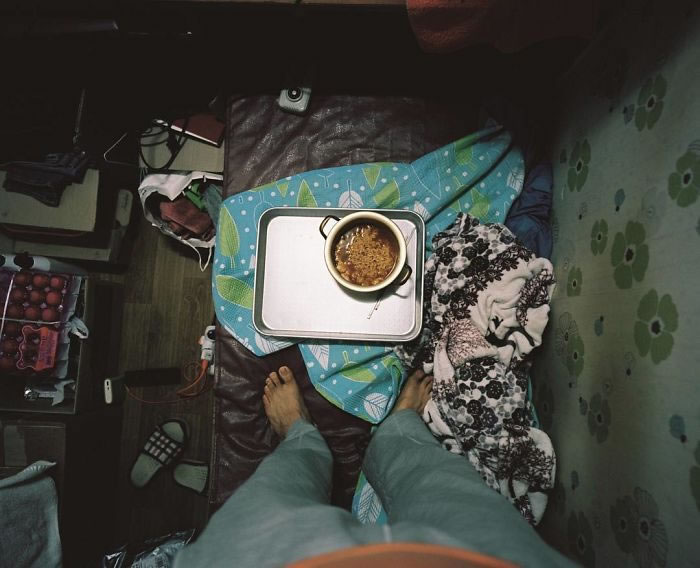
Locate an element on the screen. The width and height of the screenshot is (700, 568). orange cord is located at coordinates (201, 374).